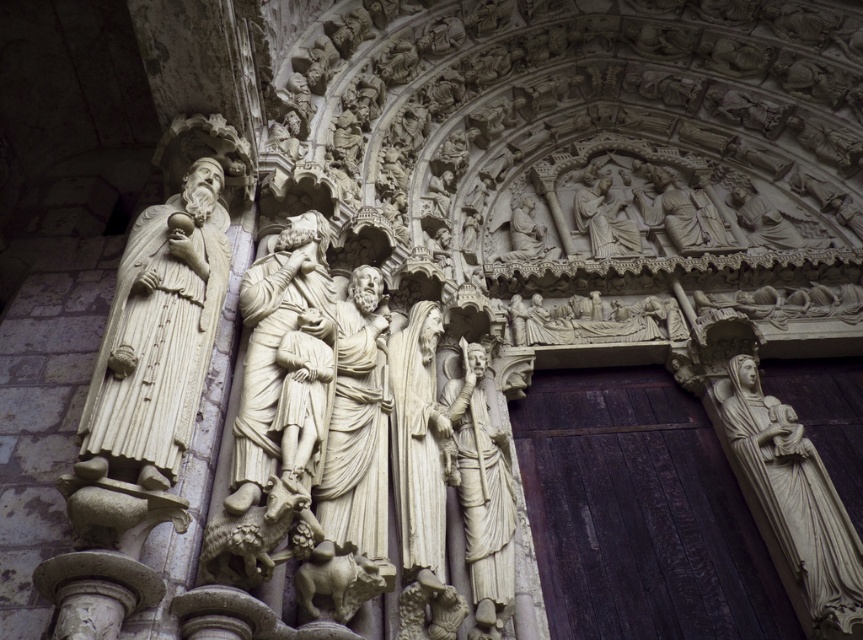
Question: Which of these objects is positioned farthest from the white stone relief at upper center?

Choices:
 (A) white marble statue at right
 (B) white marble statue at center-right
 (C) white marble statue at center

Answer: (C)

Question: Can you confirm if white marble statue at right is positioned to the left of white marble statue at center-right?

Choices:
 (A) yes
 (B) no

Answer: (B)

Question: Which point is closer to the camera taking this photo?

Choices:
 (A) (791, 586)
 (B) (244, 390)

Answer: (B)

Question: Where is white marble statue at left located in relation to white marble statue at center-right in the image?

Choices:
 (A) below
 (B) above

Answer: (B)

Question: Considering the relative positions of white marble statue at left and white marble statue at right in the image provided, where is white marble statue at left located with respect to white marble statue at right?

Choices:
 (A) left
 (B) right

Answer: (A)

Question: Which object appears closest to the camera in this image?

Choices:
 (A) white marble statue at center
 (B) dark wood door at right
 (C) white marble statue at center-right

Answer: (A)